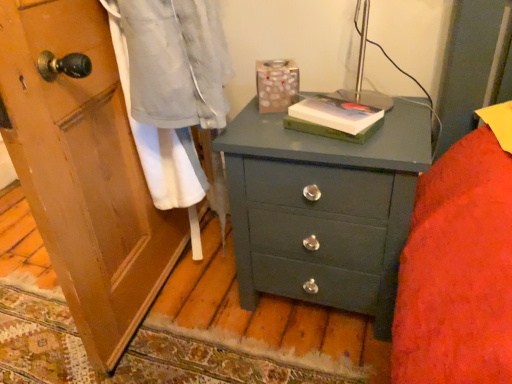
Locate an element on the screen. vacant point above hardcover book at center, marked as the 1th book in a bottom-to-top arrangement (from a real-world perspective) is located at coordinates (334, 111).